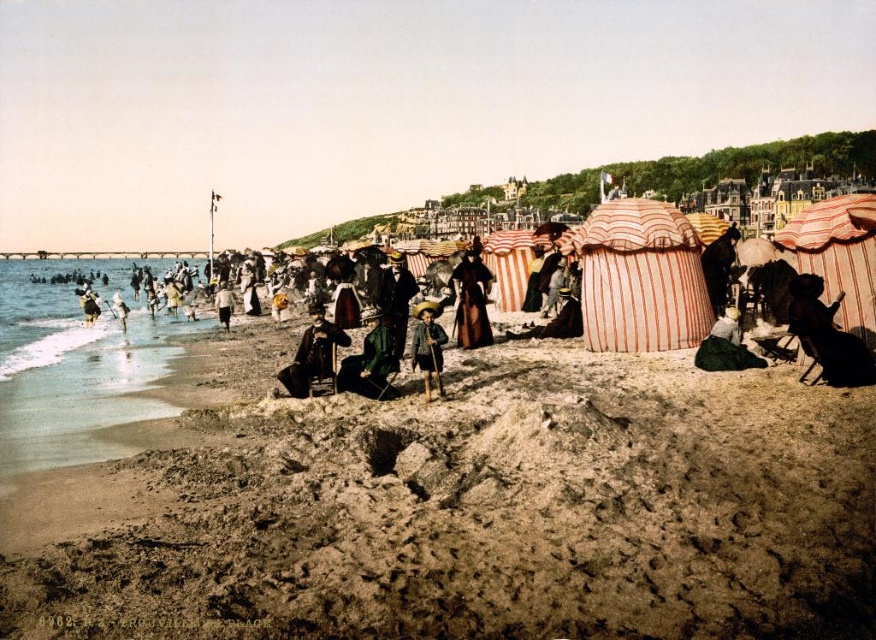
Between wooden stick at center and green fabric dress at center, which one appears on the left side from the viewer's perspective?

From the viewer's perspective, green fabric dress at center appears more on the left side.

Can you confirm if wooden stick at center is positioned below green fabric dress at center?

Yes, wooden stick at center is below green fabric dress at center.

Locate an element on the screen. The height and width of the screenshot is (640, 876). wooden stick at center is located at coordinates (428, 346).

Identify the location of wooden stick at center. The image size is (876, 640). tap(428, 346).

Which is more to the left, dark brown velvet coat at center or green fabric dress at center?

Positioned to the left is green fabric dress at center.

Which is below, dark brown velvet coat at center or green fabric dress at center?

Positioned lower is dark brown velvet coat at center.

Find the location of `dark brown velvet coat at center`. dark brown velvet coat at center is located at coordinates (313, 353).

Who is shorter, dark brown velvet coat at center or green velvet dress at lower right?

With less height is green velvet dress at lower right.

Who is higher up, dark brown velvet coat at center or green velvet dress at lower right?

dark brown velvet coat at center is higher up.

Where is `dark brown velvet coat at center`? The image size is (876, 640). dark brown velvet coat at center is located at coordinates (313, 353).